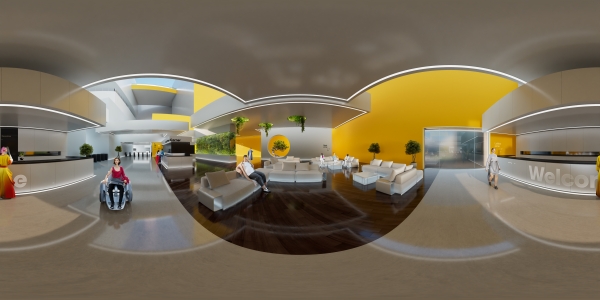
I want to click on foot rest, so click(x=367, y=177).